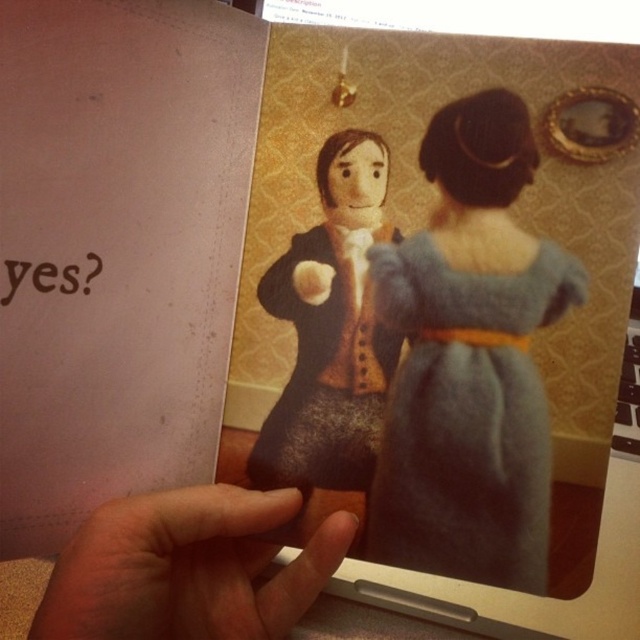
You are an artist trying to draw the scene from the book. You need to decide the vertical positioning of the blue felt dress at center and fuzzy skin at lower left. Based on the image, which one should you draw higher up?

The blue felt dress at center should be drawn higher up because it is taller than the fuzzy skin at lower left.

You are an artist trying to draw the scene between the blue felt dress at center and the fuzzy skin at lower left. If your pencil can only draw within a 4 inch radius, will you be able to capture the entire space between them in one drawing?

The distance between the blue felt dress at center and fuzzy skin at lower left is 3.93 inches, which is within the 4 inch radius. Therefore, you can capture the entire space between them in one drawing.

You are an artist trying to draw the scene from the book. You need to decide which object to sketch first based on their sizes. Which object is narrower between the blue felt dress at center and the fuzzy skin at lower left?

The blue felt dress at center is narrower than the fuzzy skin at lower left, so you should sketch the blue felt dress at center first since it is thinner.